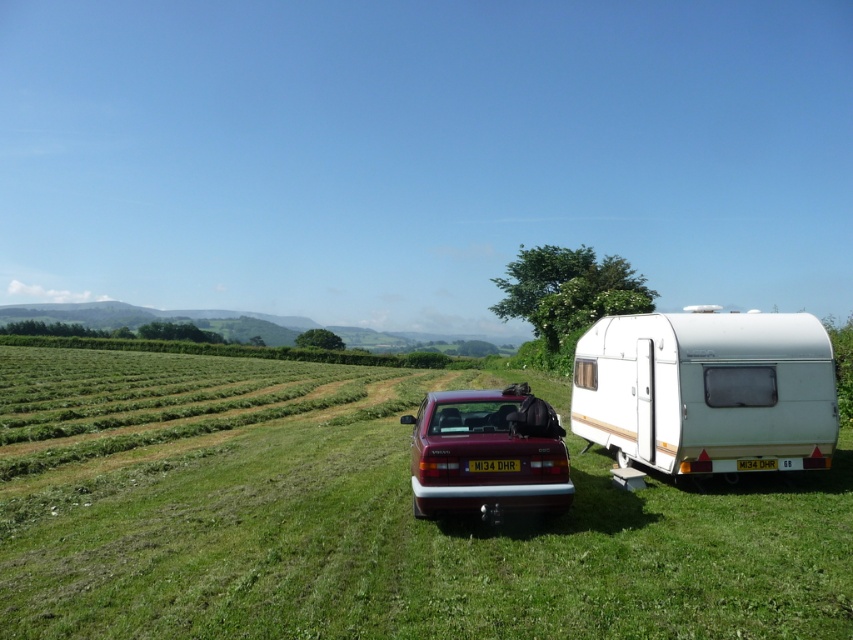
Based on the photo, can you confirm if maroon metallic car at center is thinner than white matte caravan at right?

Incorrect, maroon metallic car at center's width is not less than white matte caravan at right's.

Between maroon metallic car at center and white matte caravan at right, which one has less height?

Standing shorter between the two is maroon metallic car at center.

Between point (90, 618) and point (686, 337), which one is positioned in front?

Positioned in front is point (90, 618).

Where is `maroon metallic car at center`? maroon metallic car at center is located at coordinates (364, 516).

Who is shorter, white matte caravan at right or matte red car at center?

Standing shorter between the two is matte red car at center.

Does white matte caravan at right have a greater width compared to matte red car at center?

Yes, white matte caravan at right is wider than matte red car at center.

The image size is (853, 640). I want to click on white matte caravan at right, so click(706, 390).

Does point (227, 438) lie behind point (515, 403)?

That is True.

Does maroon metallic car at center have a lesser height compared to matte red car at center?

Indeed, maroon metallic car at center has a lesser height compared to matte red car at center.

Measure the distance between maroon metallic car at center and camera.

maroon metallic car at center is 16.12 feet from camera.

Where is `maroon metallic car at center`? The width and height of the screenshot is (853, 640). maroon metallic car at center is located at coordinates (364, 516).